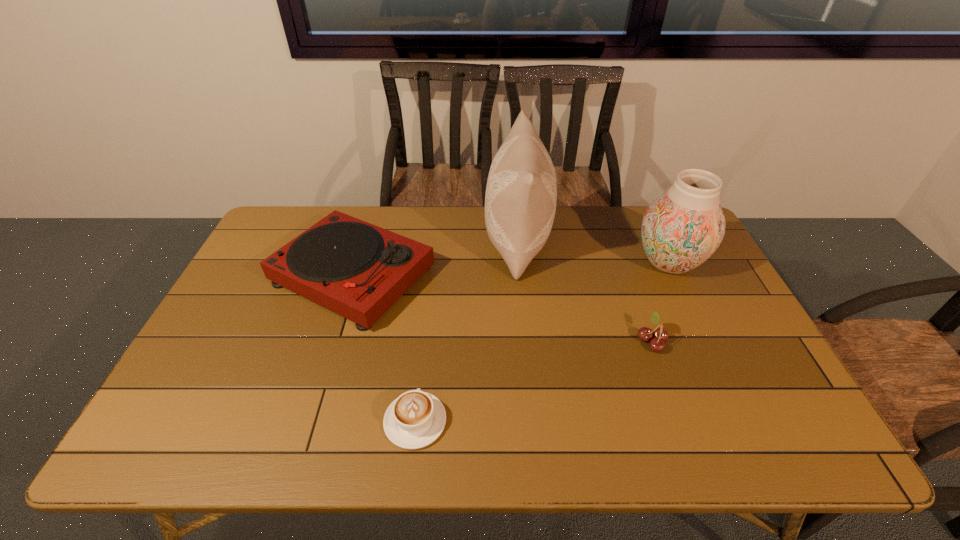
Where is `free space that is in between the second tallest object and the cappuccino`? This screenshot has width=960, height=540. free space that is in between the second tallest object and the cappuccino is located at coordinates (542, 342).

Choose which object is the third nearest neighbor to the fourth tallest object. Please provide its 2D coordinates. Your answer should be formatted as a tuple, i.e. [(x, y)], where the tuple contains the x and y coordinates of a point satisfying the conditions above.

[(414, 420)]

Locate an element on the screen. Image resolution: width=960 pixels, height=540 pixels. the fourth closest object relative to the record player is located at coordinates (683, 227).